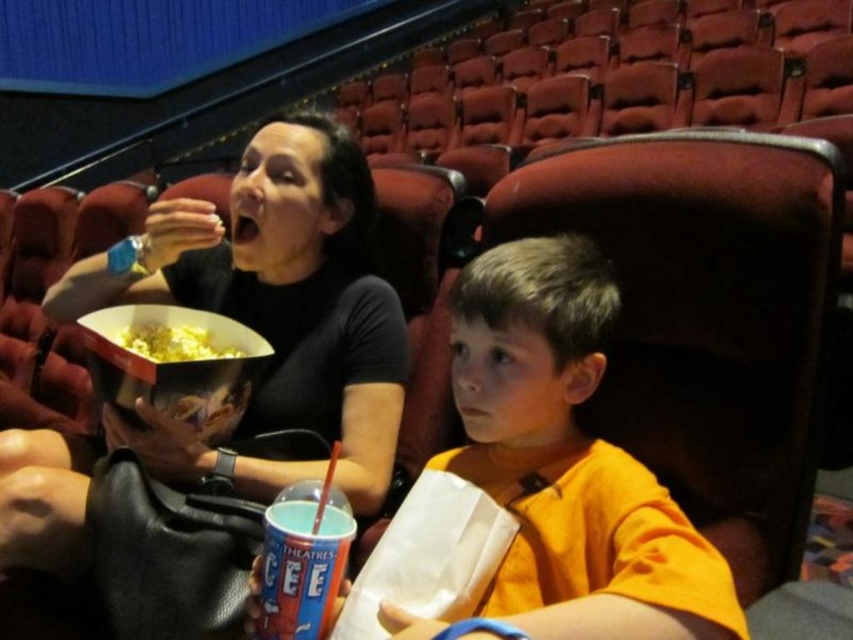
Is matte black popcorn bucket at center thinner than yellow popcorn at center?

No, matte black popcorn bucket at center is not thinner than yellow popcorn at center.

How far apart are matte black popcorn bucket at center and yellow popcorn at center?

matte black popcorn bucket at center and yellow popcorn at center are 7.74 inches apart.

I want to click on matte black popcorn bucket at center, so click(x=281, y=291).

Does blue plastic cup at lower center have a greater height compared to yellow popcorn at center?

Yes.

This screenshot has width=853, height=640. What do you see at coordinates (300, 568) in the screenshot?
I see `blue plastic cup at lower center` at bounding box center [300, 568].

Where is `blue plastic cup at lower center`? Image resolution: width=853 pixels, height=640 pixels. blue plastic cup at lower center is located at coordinates [x=300, y=568].

Is point (524, 365) behind point (328, 564)?

Yes, it is.

Is orange cotton shirt at center smaller than blue plastic cup at lower center?

No.

This screenshot has height=640, width=853. What do you see at coordinates (564, 465) in the screenshot? I see `orange cotton shirt at center` at bounding box center [564, 465].

Identify the location of orange cotton shirt at center. (564, 465).